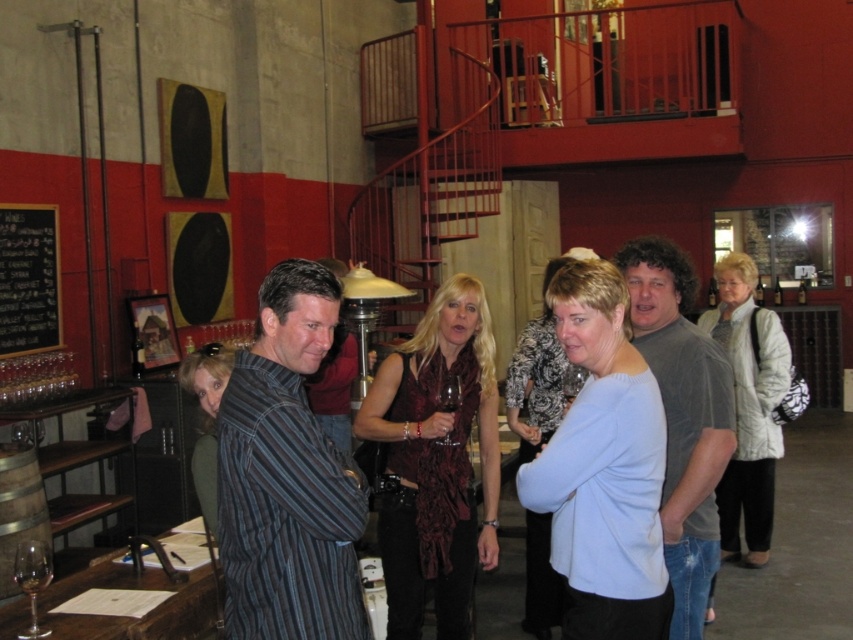
Question: Does black chalkboard at left appear on the right side of transparent glass at center?

Choices:
 (A) no
 (B) yes

Answer: (A)

Question: Is black chalkboard at left to the left of clear glass wine glass at lower left from the viewer's perspective?

Choices:
 (A) yes
 (B) no

Answer: (A)

Question: Which object appears farthest from the camera in this image?

Choices:
 (A) striped cotton shirt at center
 (B) transparent glass at center

Answer: (B)

Question: Is black chalkboard at left wider than transparent glass at center?

Choices:
 (A) yes
 (B) no

Answer: (A)

Question: Which of these objects is positioned farthest from the clear glass wine glass at lower left?

Choices:
 (A) transparent glass at center
 (B) gray cotton t-shirt at center

Answer: (B)

Question: Estimate the real-world distances between objects in this image. Which object is farther from the gray cotton t-shirt at center?

Choices:
 (A) transparent glass at center
 (B) clear glass wine glass at lower left
 (C) black chalkboard at left

Answer: (C)